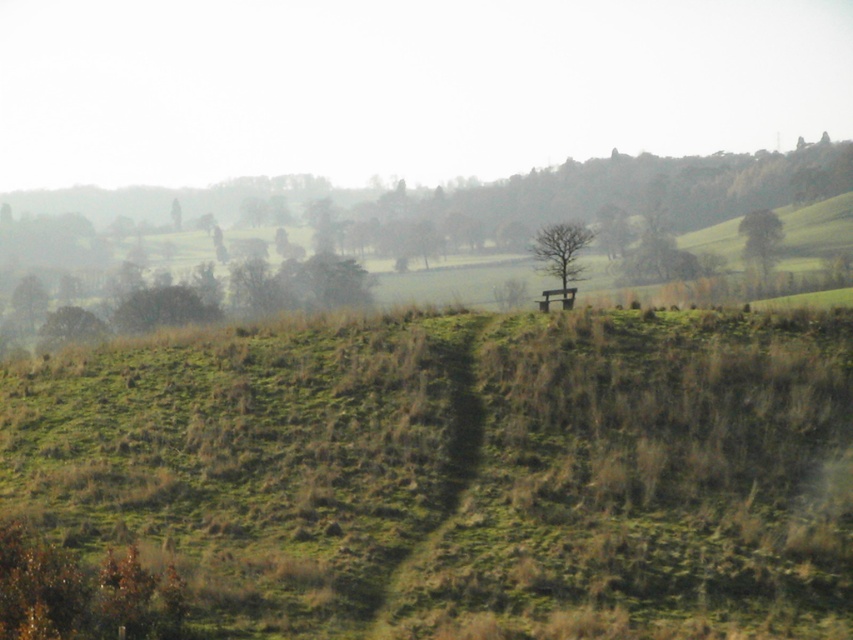
Question: Which object appears farthest from the camera in this image?

Choices:
 (A) bare wood tree at center
 (B) green grassy hill at upper center

Answer: (B)

Question: Does bare wood tree at center have a larger size compared to green grassy tree at left?

Choices:
 (A) no
 (B) yes

Answer: (B)

Question: Does green grassy tree at left have a larger size compared to green leafy tree at upper right?

Choices:
 (A) no
 (B) yes

Answer: (B)

Question: Which of these objects is positioned farthest from the green grassy tree at left?

Choices:
 (A) green leafy tree at upper right
 (B) bare wood tree at center

Answer: (A)

Question: Which point is farther to the camera?

Choices:
 (A) bare wood tree at center
 (B) green grassy hill at upper center
 (C) green grassy tree at left
 (D) green leafy tree at upper right

Answer: (B)

Question: Can you confirm if green grassy tree at left is positioned to the left of green leafy tree at upper right?

Choices:
 (A) no
 (B) yes

Answer: (B)